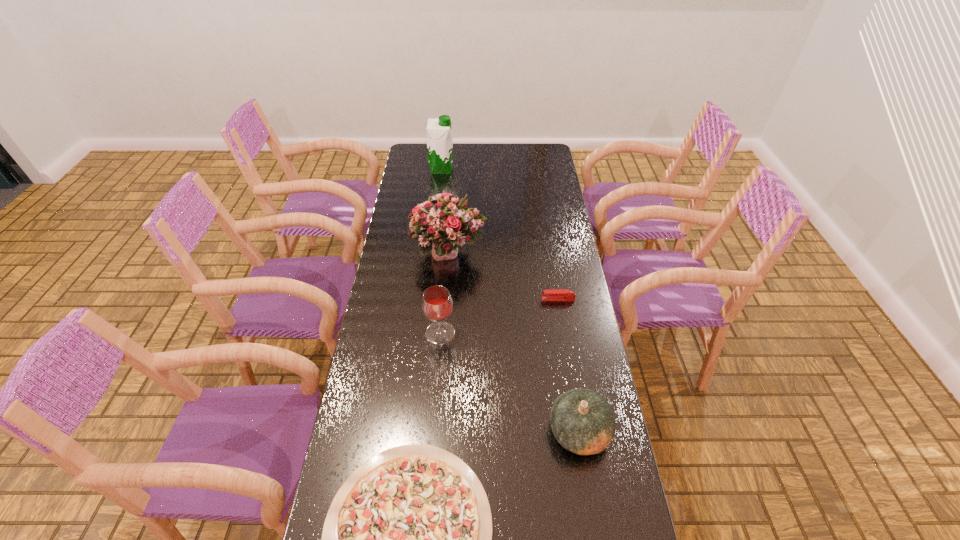
Find the location of `vacant position at the far edge of the desktop`. vacant position at the far edge of the desktop is located at coordinates (469, 147).

Locate an element on the screen. The height and width of the screenshot is (540, 960). vacant region at the left edge is located at coordinates (385, 354).

This screenshot has height=540, width=960. In the image, there is a desktop. What are the coordinates of `vacant space at the right edge` in the screenshot? It's located at (556, 256).

Image resolution: width=960 pixels, height=540 pixels. What are the coordinates of `free space at the far left corner of the desktop` in the screenshot? It's located at (413, 152).

In the image, there is a desktop. In order to click on vacant space at the far right corner in this screenshot , I will do `click(552, 159)`.

Identify the location of free space between the fourth tallest object and the bouquet. (515, 342).

The width and height of the screenshot is (960, 540). What are the coordinates of `unoccupied position between the fifth nearest object and the stapler` in the screenshot? It's located at (504, 276).

Image resolution: width=960 pixels, height=540 pixels. In order to click on free space that is in between the soya milk and the stapler in this screenshot , I will do `click(500, 234)`.

Identify the location of free spot between the soya milk and the second shortest object. (500, 234).

What are the coordinates of `vacant area between the soya milk and the fourth tallest object` in the screenshot? It's located at (511, 300).